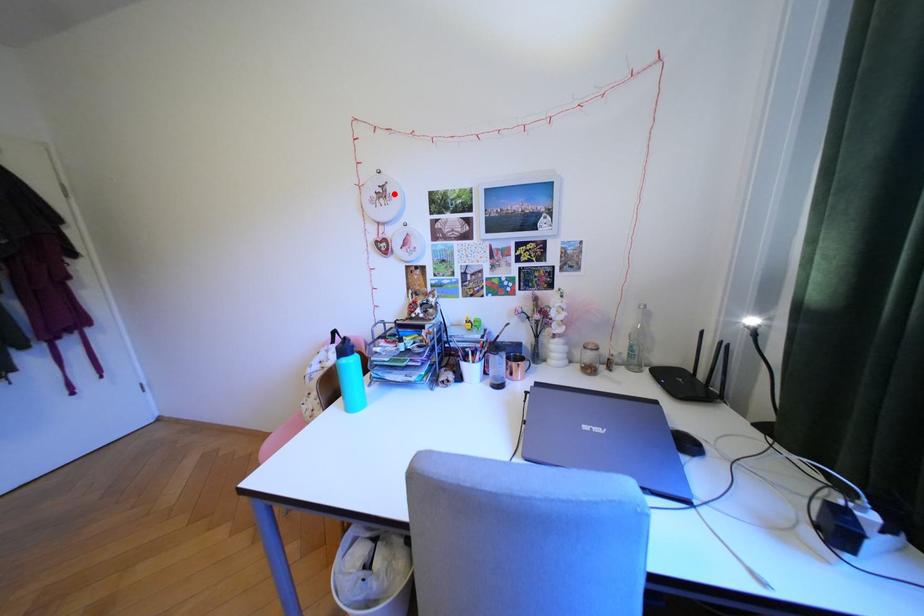
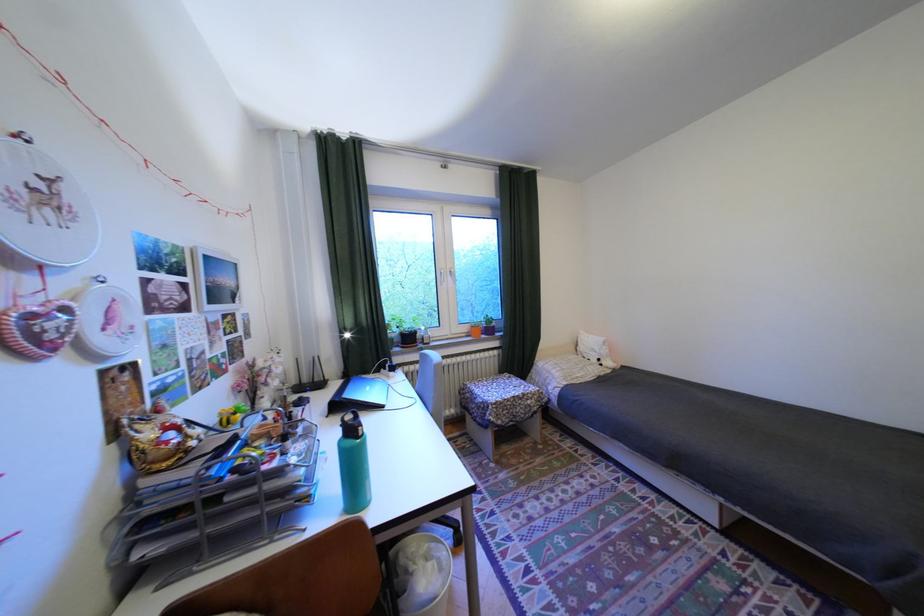
Question: A red point is marked in image1. In image2, is the corresponding 3D point closer to the camera or farther? Reply with the corresponding letter.

Choices:
 (A) The corresponding 3D point is closer.
 (B) The corresponding 3D point is farther.

Answer: (B)